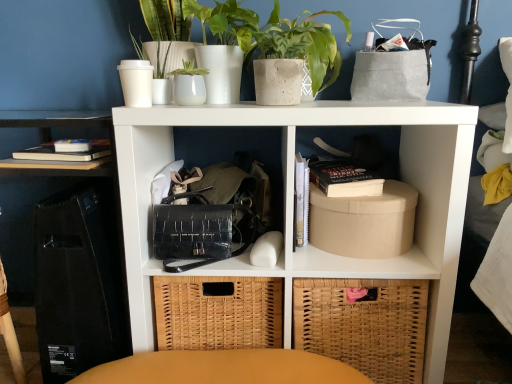
What is the approximate height of white matte shelf at center, the first shelf positioned from the right?

white matte shelf at center, the first shelf positioned from the right, is 30.48 inches tall.

The width and height of the screenshot is (512, 384). Describe the element at coordinates (292, 201) in the screenshot. I see `white matte shelf at center, the second shelf from the top` at that location.

In order to face woven brown basket at lower right, should I rotate leftwards or rightwards?

It's best to rotate right around 12.780 degrees.

What is the approximate width of speckled concrete pot at upper center?

speckled concrete pot at upper center is 8.87 inches wide.

The height and width of the screenshot is (384, 512). What do you see at coordinates (364, 222) in the screenshot?
I see `beige cardboard box at right` at bounding box center [364, 222].

You are a GUI agent. You are given a task and a screenshot of the screen. Output one action in this format:
    pyautogui.click(x=<x>, y=<y>)
    Task: Click on the hardcover books at left, the 2th shelf in the right-to-left sequence
    This screenshot has width=512, height=384.
    Given the screenshot: What is the action you would take?
    pyautogui.click(x=51, y=138)

Which point is more distant from viewer, (80, 171) or (324, 177)?

The point (324, 177) is behind.

Based on the photo, are hardcover books at left, the 2th shelf in the right-to-left sequence, and hardcover black book at center-right far apart?

That's not correct — hardcover books at left, the 2th shelf in the right-to-left sequence, is a little close to hardcover black book at center-right.

From a real-world perspective, is hardcover books at left, acting as the second shelf starting from the bottom, beneath hardcover black book at center-right?

No, from a real-world perspective, hardcover books at left, acting as the second shelf starting from the bottom, is not under hardcover black book at center-right.

From the image's perspective, would you say hardcover books at left, which appears as the 1th shelf when viewed from the top, is shown under hardcover black book at center-right?

Actually, hardcover books at left, which appears as the 1th shelf when viewed from the top, appears above hardcover black book at center-right in the image.

From a real-world perspective, is woven brown basket at lower right positioned under white matte shelf at center, placed as the first shelf when sorted from bottom to top, based on gravity?

Indeed, from a real-world perspective, woven brown basket at lower right is positioned beneath white matte shelf at center, placed as the first shelf when sorted from bottom to top.

Who is taller, woven brown basket at lower right or white matte shelf at center, the second shelf from the top?

With more height is white matte shelf at center, the second shelf from the top.

What's the angular difference between woven brown basket at lower right and white matte shelf at center, placed as the first shelf when sorted from bottom to top,'s facing directions?

The angular difference between woven brown basket at lower right and white matte shelf at center, placed as the first shelf when sorted from bottom to top, is 0.964 degrees.

Which object is further away from the camera taking this photo, woven brown basket at lower right or black crocodile-patterned handbag at center?

Positioned behind is woven brown basket at lower right.

In the scene shown: Considering the sizes of objects woven brown basket at lower right and black crocodile-patterned handbag at center in the image provided, who is thinner, woven brown basket at lower right or black crocodile-patterned handbag at center?

Thinner between the two is woven brown basket at lower right.

Which of these two, woven brown basket at lower right or black crocodile-patterned handbag at center, is bigger?

black crocodile-patterned handbag at center is bigger.

You are a GUI agent. You are given a task and a screenshot of the screen. Output one action in this format:
    pyautogui.click(x=<x>, y=<y>)
    Task: Click on the book below the speckled concrete pot at upper center (from the image's perspective)
    The width and height of the screenshot is (512, 384).
    Given the screenshot: What is the action you would take?
    click(x=344, y=179)

What's the angular difference between speckled concrete pot at upper center and hardcover black book at center-right's facing directions?

2.77 degrees.

Which point is more forward, (327, 67) or (358, 172)?

The point (327, 67) is more forward.

Can you confirm if speckled concrete pot at upper center is wider than hardcover black book at center-right?

No.

From the hardcover black book at center-right, count the 1st shelf to the left and point to it. Please provide its 2D coordinates.

[(292, 201)]

From the image's perspective, is hardcover black book at center-right on white matte shelf at center, the second shelf from the top?

Correct, hardcover black book at center-right appears higher than white matte shelf at center, the second shelf from the top, in the image.

Can you tell me how much hardcover black book at center-right and white matte shelf at center, which is the 2th shelf from left to right, differ in facing direction?

The angular difference between hardcover black book at center-right and white matte shelf at center, which is the 2th shelf from left to right, is 0.784 degrees.

Which is in front, point (205, 198) or point (426, 313)?

The point (426, 313) is more forward.

Does black crocodile-patterned handbag at center have a greater width compared to woven brown basket at lower right?

Yes.

From the picture: Between black crocodile-patterned handbag at center and woven brown basket at lower right, which one appears on the left side from the viewer's perspective?

From the viewer's perspective, black crocodile-patterned handbag at center appears more on the left side.

Can you confirm if black crocodile-patterned handbag at center is shorter than woven brown basket at lower right?

Yes, black crocodile-patterned handbag at center is shorter than woven brown basket at lower right.

Does white matte shelf at center, which is the 2th shelf from left to right, have a greater height compared to speckled concrete pot at upper center?

Yes.

Is white matte shelf at center, the second shelf from the top, wider than speckled concrete pot at upper center?

Correct, the width of white matte shelf at center, the second shelf from the top, exceeds that of speckled concrete pot at upper center.

Would you say white matte shelf at center, placed as the first shelf when sorted from bottom to top, is to the left or to the right of speckled concrete pot at upper center in the picture?

From the image, it's evident that white matte shelf at center, placed as the first shelf when sorted from bottom to top, is to the left of speckled concrete pot at upper center.

From the picture: How much distance is there between white matte shelf at center, placed as the first shelf when sorted from bottom to top, and speckled concrete pot at upper center?

They are 11.03 inches apart.

Locate an element on the screen. This screenshot has width=512, height=384. book directly beneath the hardcover books at left, the 2th shelf in the right-to-left sequence (from a real-world perspective) is located at coordinates (344, 179).

Identify the location of basket to the right of white matte shelf at center, which is the 2th shelf from left to right. The image size is (512, 384). (364, 324).

Estimate the real-world distances between objects in this image. Which object is closer to speckled concrete pot at upper center, hardcover black book at center-right or hardcover books at left, the 2th shelf in the right-to-left sequence?

The object closer to speckled concrete pot at upper center is hardcover black book at center-right.

From the image, which object appears to be nearer to white matte shelf at center, the first shelf positioned from the right, hardcover black book at center-right or woven brown basket at lower right?

woven brown basket at lower right.

Based on their spatial positions, is white matte shelf at center, the second shelf from the top, or woven brown basket at lower right closer to beige cardboard box at right?

The object closer to beige cardboard box at right is woven brown basket at lower right.

Based on their spatial positions, is white matte shelf at center, the second shelf from the top, or woven brown basket at lower right closer to black crocodile-patterned handbag at center?

Based on the image, white matte shelf at center, the second shelf from the top, appears to be nearer to black crocodile-patterned handbag at center.

Estimate the real-world distances between objects in this image. Which object is closer to white matte shelf at center, the second shelf from the top, woven brown basket at lower right or beige cardboard box at right?

beige cardboard box at right is positioned closer to the anchor white matte shelf at center, the second shelf from the top.

Which object lies nearer to the anchor point hardcover black book at center-right, speckled concrete pot at upper center or hardcover books at left, acting as the second shelf starting from the bottom?

The object closer to hardcover black book at center-right is speckled concrete pot at upper center.

From the image, which object appears to be nearer to speckled concrete pot at upper center, hardcover black book at center-right or beige cardboard box at right?

hardcover black book at center-right lies closer to speckled concrete pot at upper center than the other object.

Looking at the image, which one is located closer to speckled concrete pot at upper center, beige cardboard box at right or woven brown basket at lower right?

Among the two, beige cardboard box at right is located nearer to speckled concrete pot at upper center.

You are a GUI agent. You are given a task and a screenshot of the screen. Output one action in this format:
    pyautogui.click(x=<x>, y=<y>)
    Task: Click on the handbag between hardcover books at left, acting as the second shelf starting from the bottom, and beige cardboard box at right
    The width and height of the screenshot is (512, 384).
    Given the screenshot: What is the action you would take?
    pyautogui.click(x=215, y=258)

The image size is (512, 384). I want to click on book that lies between speckled concrete pot at upper center and black crocodile-patterned handbag at center from top to bottom, so click(344, 179).

Identify the location of book between hardcover books at left, the 2th shelf in the right-to-left sequence, and beige cardboard box at right. The height and width of the screenshot is (384, 512). (344, 179).

At what (x,y) coordinates should I click in order to perform the action: click on book between speckled concrete pot at upper center and beige cardboard box at right in the vertical direction. Please return your answer as a coordinate pair (x, y). Looking at the image, I should click on (344, 179).